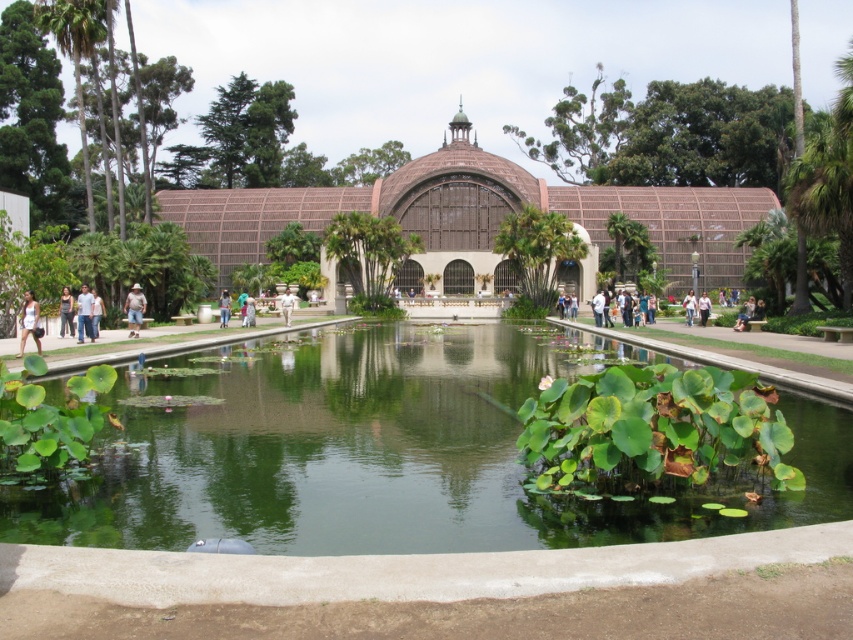
Question: Can you confirm if light blue jeans at left is wider than light blue denim jeans at center?

Choices:
 (A) no
 (B) yes

Answer: (A)

Question: Can you confirm if green leafy pond at center is thinner than white fabric person at lower left?

Choices:
 (A) no
 (B) yes

Answer: (A)

Question: Which object is farther from the camera taking this photo?

Choices:
 (A) white cotton shirt at center
 (B) light blue jeans at left
 (C) dark blue jeans at left
 (D) green leafy pond at center

Answer: (A)

Question: Is green leafy pond at center to the right of light blue denim jeans at center from the viewer's perspective?

Choices:
 (A) yes
 (B) no

Answer: (A)

Question: Which object is the closest to the dark blue jeans at left?

Choices:
 (A) light blue denim jeans at center
 (B) light blue jeans at left
 (C) brown woven hat at center

Answer: (B)

Question: Which point appears closest to the camera in this image?

Choices:
 (A) (68, 330)
 (B) (21, 330)

Answer: (B)